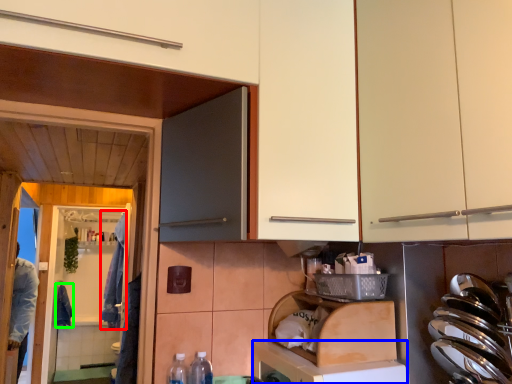
Question: Which object is positioned closest to laundry (highlighted by a red box)? Select from dish washer (highlighted by a blue box) and laundry (highlighted by a green box).

Choices:
 (A) dish washer
 (B) laundry

Answer: (B)